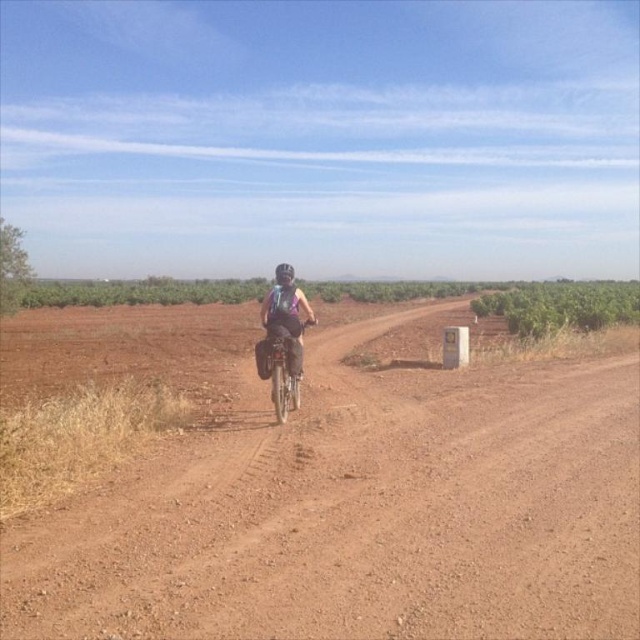
Question: Can you confirm if matte purple backpack at center is positioned to the right of shiny metallic bicycle at center?

Choices:
 (A) yes
 (B) no

Answer: (B)

Question: Can you confirm if brown gravel road at center is smaller than matte purple backpack at center?

Choices:
 (A) yes
 (B) no

Answer: (B)

Question: Which of the following is the farthest from the observer?

Choices:
 (A) shiny metallic bicycle at center
 (B) brown gravel road at center
 (C) matte purple backpack at center

Answer: (C)

Question: Which object appears closest to the camera in this image?

Choices:
 (A) brown gravel road at center
 (B) matte purple backpack at center
 (C) shiny metallic bicycle at center

Answer: (A)

Question: Is brown gravel road at center smaller than shiny metallic bicycle at center?

Choices:
 (A) yes
 (B) no

Answer: (B)

Question: Which object appears closest to the camera in this image?

Choices:
 (A) shiny metallic bicycle at center
 (B) matte purple backpack at center

Answer: (A)